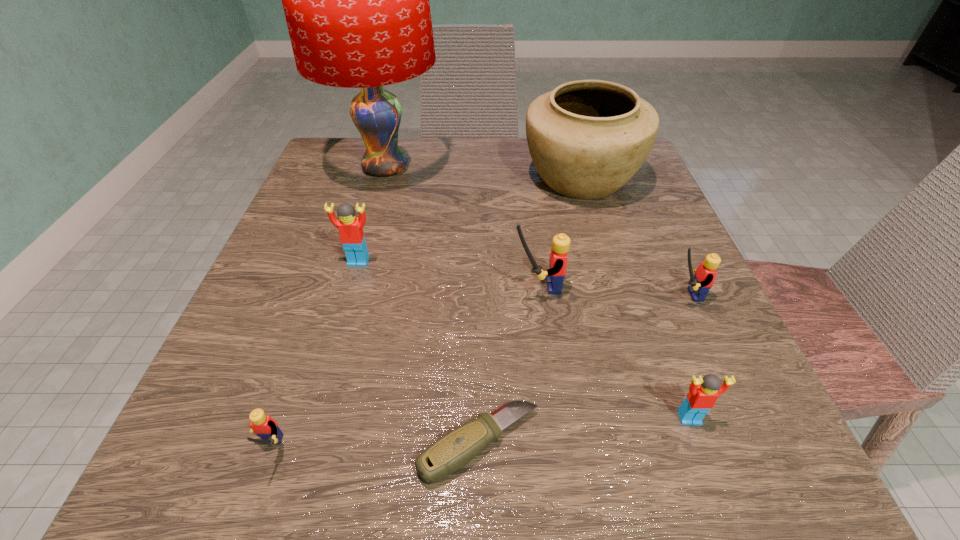
Find the location of `vacant space located on the front-facing side of the rightmost yellow Lego`. vacant space located on the front-facing side of the rightmost yellow Lego is located at coordinates (592, 295).

Image resolution: width=960 pixels, height=540 pixels. Find the location of `free spot located 0.310m on the front-facing side of the rightmost yellow Lego`. free spot located 0.310m on the front-facing side of the rightmost yellow Lego is located at coordinates (468, 295).

Image resolution: width=960 pixels, height=540 pixels. What are the coordinates of `vacant space positioned 0.370m on the front-facing side of the rightmost yellow Lego` in the screenshot? It's located at (431, 295).

Locate an element on the screen. The image size is (960, 540). free space located on the back of the gray pocketknife is located at coordinates (480, 268).

At what (x,y) coordinates should I click in order to perform the action: click on lampshade positioned at the far edge. Please return your answer as a coordinate pair (x, y). This screenshot has width=960, height=540. Looking at the image, I should click on (356, 0).

You are a GUI agent. You are given a task and a screenshot of the screen. Output one action in this format:
    pyautogui.click(x=<x>, y=<y>)
    Task: Click on the pottery at the far edge
    
    Given the screenshot: What is the action you would take?
    (x=587, y=138)

Locate an element on the screen. pocketknife that is at the near edge is located at coordinates (452, 451).

At what (x,y) coordinates should I click in order to perform the action: click on lampshade that is positioned at the left edge. Please return your answer as a coordinate pair (x, y). Looking at the image, I should click on (356, 0).

You are a GUI agent. You are given a task and a screenshot of the screen. Output one action in this format:
    pyautogui.click(x=<x>, y=<y>)
    Task: Click on the pottery at the right edge
    
    Given the screenshot: What is the action you would take?
    pyautogui.click(x=587, y=138)

Locate an element on the screen. The height and width of the screenshot is (540, 960). object that is positioned at the far left corner is located at coordinates (356, 0).